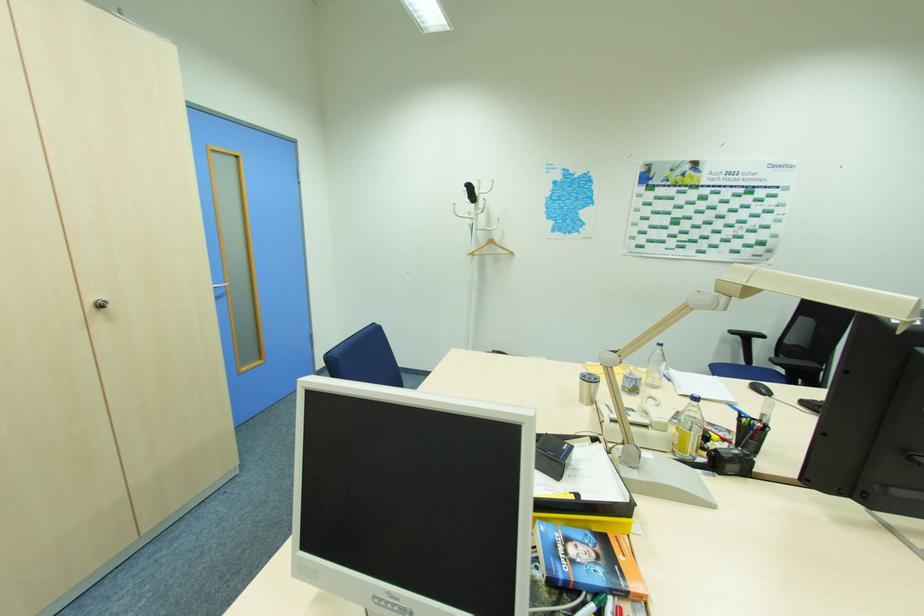
Describe the element at coordinates (101, 304) in the screenshot. I see `a silver cabinet knob` at that location.